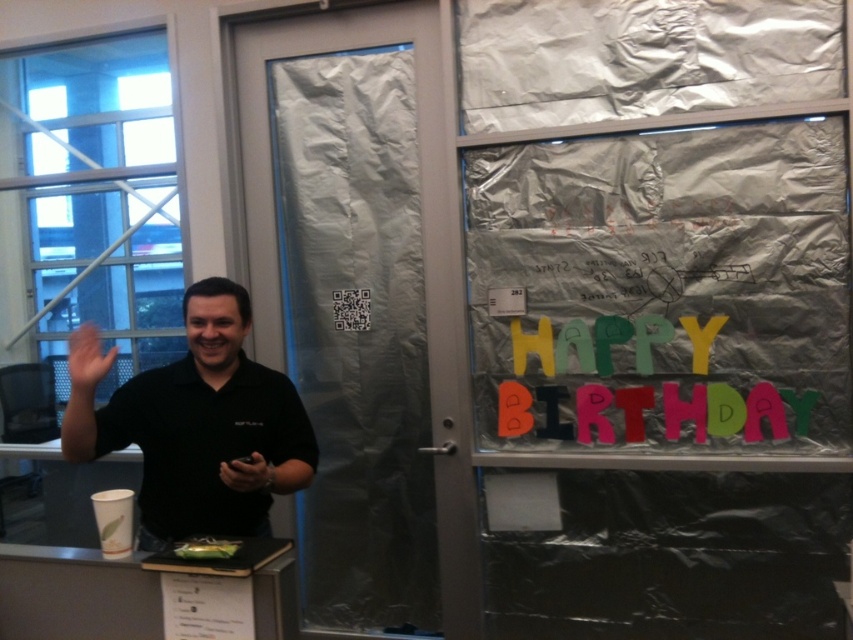
Question: Which point appears closest to the camera in this image?

Choices:
 (A) (461, 38)
 (B) (103, 369)
 (C) (300, 416)

Answer: (B)

Question: Does colorful paper letters at upper right have a larger size compared to green matte cake at center?

Choices:
 (A) yes
 (B) no

Answer: (A)

Question: Which point is farther from the camera taking this photo?

Choices:
 (A) (256, 476)
 (B) (485, 124)

Answer: (B)

Question: Is colorful paper letters at upper right wider than green matte cake at center?

Choices:
 (A) yes
 (B) no

Answer: (A)

Question: Does colorful paper letters at upper right appear on the right side of silver/metallic foil at upper right?

Choices:
 (A) no
 (B) yes

Answer: (B)

Question: Which point is farther from the camera taking this photo?

Choices:
 (A) click(91, 435)
 (B) click(229, 550)
 (C) click(86, 333)

Answer: (A)